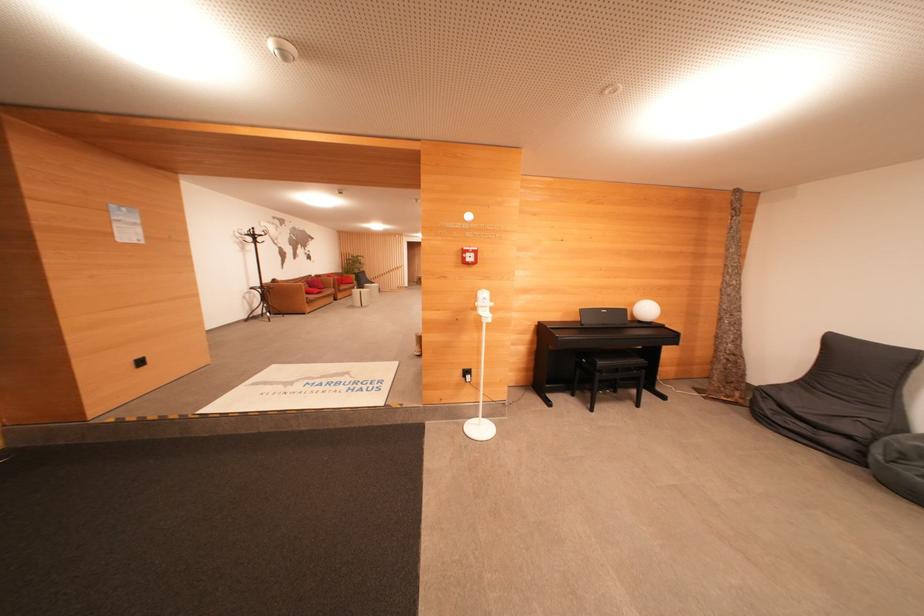
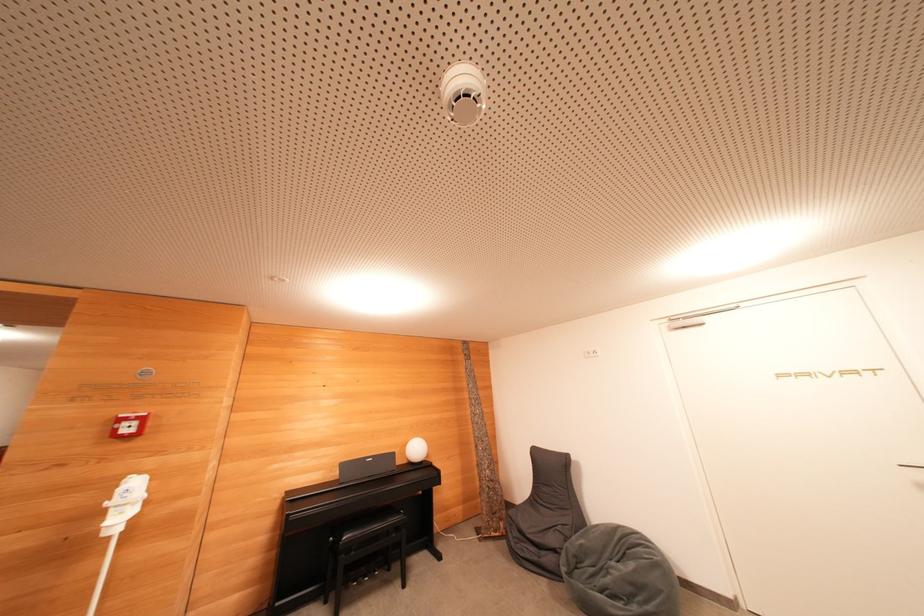
Where in the second image is the point corresponding to point 650,314 from the first image?

(419, 453)